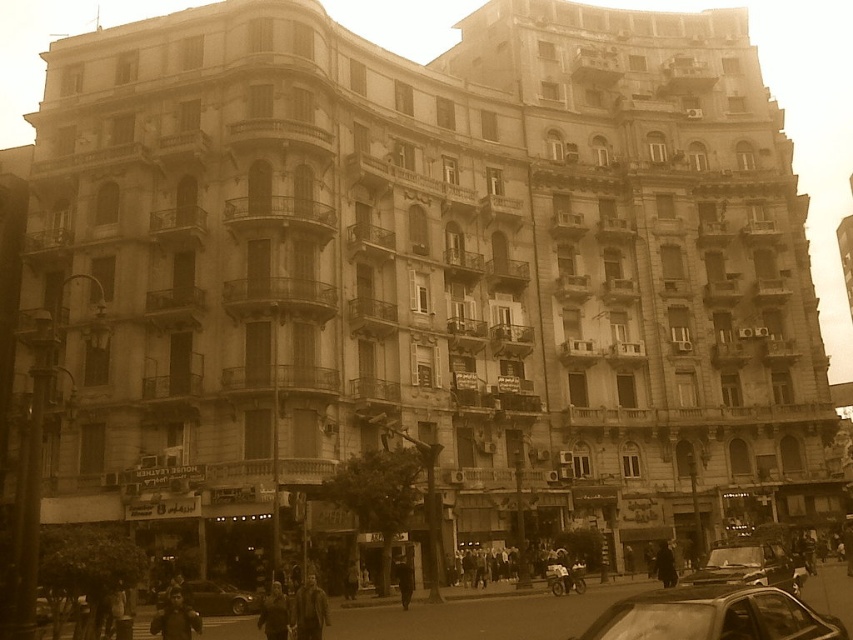
Question: Is metallic silver car at lower right bigger than metallic car at center?

Choices:
 (A) no
 (B) yes

Answer: (B)

Question: Estimate the real-world distances between objects in this image. Which object is farther from the metallic silver car at lower right?

Choices:
 (A) metallic silver car at center
 (B) metallic car at center

Answer: (A)

Question: Is metallic car at center positioned in front of metallic silver car at center?

Choices:
 (A) yes
 (B) no

Answer: (A)

Question: Among these points, which one is nearest to the camera?

Choices:
 (A) (734, 627)
 (B) (721, 564)

Answer: (A)

Question: Is the position of metallic car at center more distant than that of metallic silver car at center?

Choices:
 (A) no
 (B) yes

Answer: (A)

Question: Which point is farther from the camera taking this photo?

Choices:
 (A) (234, 608)
 (B) (606, 637)
 (C) (698, 579)

Answer: (A)